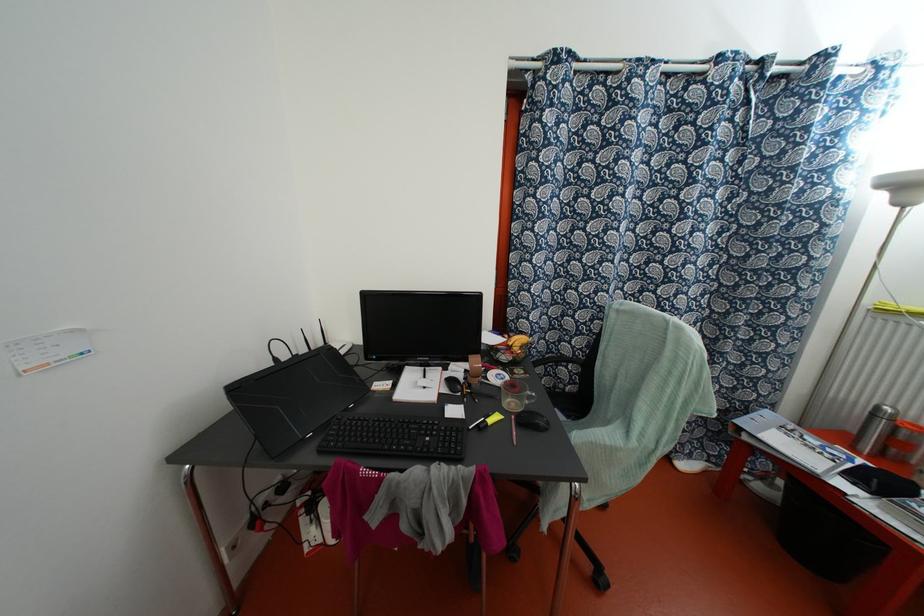
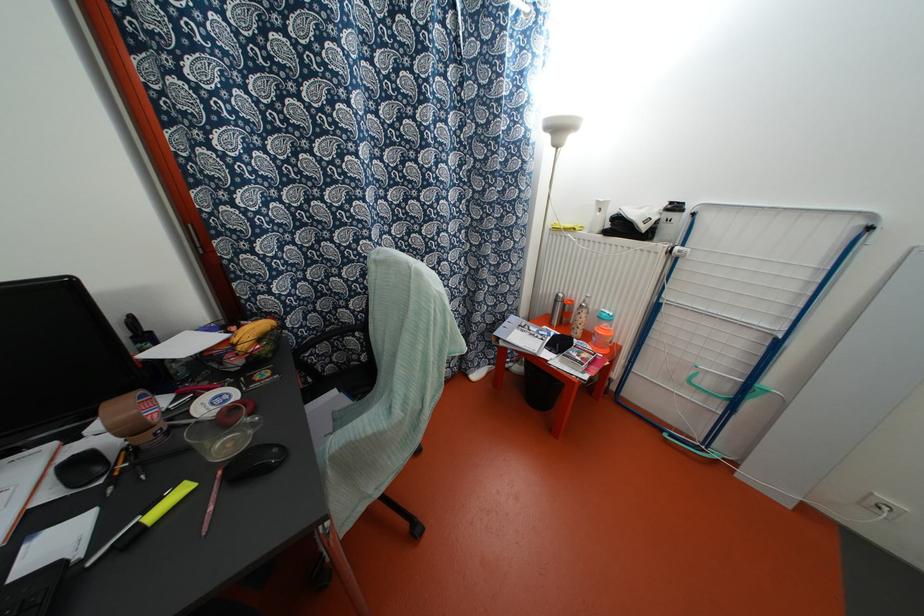
Where in the second image is the point corresponding to the point at 509,342 from the first image?

(234, 339)